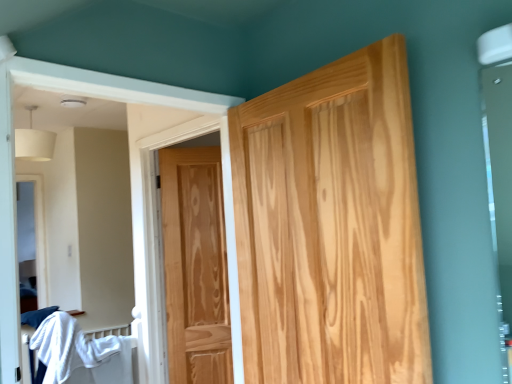
Identify the location of natural wood door at center, acting as the 1th door starting from the front. Image resolution: width=512 pixels, height=384 pixels. (331, 226).

What do you see at coordinates (80, 353) in the screenshot?
I see `white cotton bed at lower left` at bounding box center [80, 353].

The height and width of the screenshot is (384, 512). In order to click on natural wood door at center, which ranks as the second door in left-to-right order in this screenshot , I will do click(331, 226).

From a real-world perspective, is natural wood door at center, the first door viewed from the right, positioned under white cotton bed at lower left based on gravity?

No, from a real-world perspective, natural wood door at center, the first door viewed from the right, is not below white cotton bed at lower left.

Looking at this image, what's the angular difference between natural wood door at center, marked as the 2th door in a back-to-front arrangement, and white cotton bed at lower left's facing directions?

86.8 degrees separate the facing orientations of natural wood door at center, marked as the 2th door in a back-to-front arrangement, and white cotton bed at lower left.

Can you confirm if natural wood door at center, which ranks as the second door in left-to-right order, is positioned to the left of white cotton bed at lower left?

Incorrect, natural wood door at center, which ranks as the second door in left-to-right order, is not on the left side of white cotton bed at lower left.

Is white cotton bed at lower left inside or outside of natural wood door at center, acting as the 1th door starting from the front?

The correct answer is: outside.

Find the location of a particular element. Image resolution: width=512 pixels, height=384 pixels. door in front of the white cotton bed at lower left is located at coordinates (331, 226).

How many degrees apart are the facing directions of white cotton bed at lower left and natural wood door at center, the first door viewed from the right?

The angle between the facing direction of white cotton bed at lower left and the facing direction of natural wood door at center, the first door viewed from the right, is 86.8 degrees.

Can you tell me how much natural wood door at center, the first door viewed from the right, and natural wood door at center, the 2th door in the right-to-left sequence, differ in facing direction?

They differ by 59.7 degrees in their facing directions.

From the picture: Is natural wood door at center, which ranks as the second door in left-to-right order, located outside natural wood door at center, positioned as the second door in front-to-back order?

natural wood door at center, which ranks as the second door in left-to-right order, is positioned outside natural wood door at center, positioned as the second door in front-to-back order.

Based on the photo, is natural wood door at center, the first door viewed from the right, oriented away from natural wood door at center, which is the 1th door in back-to-front order?

That's not correct — natural wood door at center, the first door viewed from the right, is not looking away from natural wood door at center, which is the 1th door in back-to-front order.

Locate an element on the screen. door located below the natural wood door at center, which ranks as the second door in left-to-right order (from the image's perspective) is located at coordinates (195, 266).

Would you say natural wood door at center, positioned as the second door in front-to-back order, is part of white cotton bed at lower left's contents?

Definitely not — natural wood door at center, positioned as the second door in front-to-back order, is not inside white cotton bed at lower left.

Is white cotton bed at lower left positioned behind natural wood door at center, which is the 1th door in back-to-front order?

No, it is in front of natural wood door at center, which is the 1th door in back-to-front order.

From the image's perspective, between white cotton bed at lower left and natural wood door at center, which is the 1th door in back-to-front order, which one is located above?

natural wood door at center, which is the 1th door in back-to-front order, from the image's perspective.

Where is `the 1st door directly above the white cotton bed at lower left (from a real-world perspective)`? The height and width of the screenshot is (384, 512). the 1st door directly above the white cotton bed at lower left (from a real-world perspective) is located at coordinates (195, 266).

Can you confirm if natural wood door at center, which is the 1th door in back-to-front order, is thinner than white cotton bed at lower left?

Yes, natural wood door at center, which is the 1th door in back-to-front order, is thinner than white cotton bed at lower left.

Is natural wood door at center, which is the 1th door in back-to-front order, positioned with its back to white cotton bed at lower left?

That's not correct — natural wood door at center, which is the 1th door in back-to-front order, is not looking away from white cotton bed at lower left.

From the image's perspective, which one is positioned higher, natural wood door at center, the 2th door in the right-to-left sequence, or white cotton bed at lower left?

natural wood door at center, the 2th door in the right-to-left sequence, from the image's perspective.

From a real-world perspective, who is located lower, natural wood door at center, the 2th door in the right-to-left sequence, or white cotton bed at lower left?

white cotton bed at lower left is physically lower.

Between point (217, 338) and point (247, 281), which one is positioned behind?

The point (217, 338) is farther from the camera.

Could you measure the distance between natural wood door at center, positioned as the second door in front-to-back order, and natural wood door at center, which ranks as the second door in left-to-right order?

natural wood door at center, positioned as the second door in front-to-back order, is 3.69 feet away from natural wood door at center, which ranks as the second door in left-to-right order.

Is natural wood door at center, which is the 1th door in back-to-front order, not near natural wood door at center, the first door viewed from the right?

Indeed, natural wood door at center, which is the 1th door in back-to-front order, is not near natural wood door at center, the first door viewed from the right.

Is natural wood door at center, placed as the 1th door when sorted from left to right, in front of or behind natural wood door at center, marked as the 2th door in a back-to-front arrangement, in the image?

natural wood door at center, placed as the 1th door when sorted from left to right, is positioned farther from the viewer than natural wood door at center, marked as the 2th door in a back-to-front arrangement.

This screenshot has height=384, width=512. Find the location of `bed located on the left of natural wood door at center, marked as the 2th door in a back-to-front arrangement`. bed located on the left of natural wood door at center, marked as the 2th door in a back-to-front arrangement is located at coordinates (80, 353).

In the image, there is a natural wood door at center, the first door viewed from the right. Where is `bed below it (from a real-world perspective)`? bed below it (from a real-world perspective) is located at coordinates (x=80, y=353).

Considering their positions, is natural wood door at center, which ranks as the second door in left-to-right order, positioned further to natural wood door at center, which is the 1th door in back-to-front order, than white cotton bed at lower left?

natural wood door at center, which ranks as the second door in left-to-right order, lies further to natural wood door at center, which is the 1th door in back-to-front order, than the other object.

Looking at this image, when comparing their distances from natural wood door at center, the first door viewed from the right, does natural wood door at center, positioned as the second door in front-to-back order, or white cotton bed at lower left seem closer?

natural wood door at center, positioned as the second door in front-to-back order.

Considering their positions, is white cotton bed at lower left positioned further to natural wood door at center, which ranks as the second door in left-to-right order, than natural wood door at center, which is the 1th door in back-to-front order?

white cotton bed at lower left is further to natural wood door at center, which ranks as the second door in left-to-right order.

From the image, which object appears to be nearer to white cotton bed at lower left, natural wood door at center, which is the 1th door in back-to-front order, or natural wood door at center, marked as the 2th door in a back-to-front arrangement?

natural wood door at center, which is the 1th door in back-to-front order, is positioned closer to the anchor white cotton bed at lower left.

When comparing their distances from white cotton bed at lower left, does natural wood door at center, marked as the 2th door in a back-to-front arrangement, or natural wood door at center, the 2th door in the right-to-left sequence, seem further?

Based on the image, natural wood door at center, marked as the 2th door in a back-to-front arrangement, appears to be further to white cotton bed at lower left.

Looking at the image, which one is located closer to natural wood door at center, placed as the 1th door when sorted from left to right, white cotton bed at lower left or natural wood door at center, marked as the 2th door in a back-to-front arrangement?

white cotton bed at lower left lies closer to natural wood door at center, placed as the 1th door when sorted from left to right, than the other object.

At what (x,y) coordinates should I click in order to perform the action: click on bed located between natural wood door at center, the first door viewed from the right, and natural wood door at center, positioned as the second door in front-to-back order, in the depth direction. Please return your answer as a coordinate pair (x, y). This screenshot has width=512, height=384. Looking at the image, I should click on (80, 353).